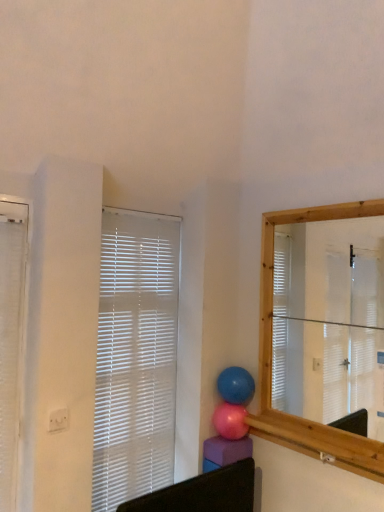
Question: Should I look upward or downward to see white textured window blind at left, acting as the second window blind starting from the right?

Choices:
 (A) down
 (B) up

Answer: (A)

Question: Can you confirm if white textured window blind at left, which ranks as the second window blind in back-to-front order, is positioned to the right of glossy blue balloon at center, the first balloon positioned from the top?

Choices:
 (A) no
 (B) yes

Answer: (A)

Question: Is white textured window blind at left, which ranks as the second window blind in back-to-front order, shorter than glossy blue balloon at center, the first balloon positioned from the top?

Choices:
 (A) yes
 (B) no

Answer: (B)

Question: From the image's perspective, is white textured window blind at left, acting as the second window blind starting from the right, on glossy blue balloon at center, the first balloon positioned from the top?

Choices:
 (A) no
 (B) yes

Answer: (B)

Question: Is glossy blue balloon at center, which ranks as the 2th balloon in bottom-to-top order, completely or partially inside white textured window blind at left, positioned as the first window blind in left-to-right order?

Choices:
 (A) no
 (B) yes

Answer: (A)

Question: Is the position of white textured window blind at left, positioned as the first window blind in left-to-right order, less distant than that of glossy blue balloon at center, the first balloon positioned from the top?

Choices:
 (A) yes
 (B) no

Answer: (A)

Question: Considering the relative sizes of white textured window blind at left, which ranks as the second window blind in back-to-front order, and glossy blue balloon at center, the first balloon positioned from the top, in the image provided, is white textured window blind at left, which ranks as the second window blind in back-to-front order, wider than glossy blue balloon at center, the first balloon positioned from the top,?

Choices:
 (A) yes
 (B) no

Answer: (B)

Question: Can you confirm if pink rubber balloon at center, the 1th balloon from the bottom, is bigger than white textured window blind at left, acting as the second window blind starting from the right?

Choices:
 (A) no
 (B) yes

Answer: (A)

Question: Is pink rubber balloon at center, the 1th balloon from the bottom, thinner than white textured window blind at left, positioned as the first window blind in left-to-right order?

Choices:
 (A) no
 (B) yes

Answer: (A)

Question: Is pink rubber balloon at center, the 1th balloon from the bottom, positioned with its back to white textured window blind at left, which ranks as the second window blind in back-to-front order?

Choices:
 (A) yes
 (B) no

Answer: (B)

Question: From a real-world perspective, is pink rubber balloon at center, the second balloon positioned from the top, below white textured window blind at left, which ranks as the second window blind in back-to-front order?

Choices:
 (A) no
 (B) yes

Answer: (B)

Question: Is pink rubber balloon at center, the 1th balloon from the bottom, at the right side of white textured window blind at left, arranged as the 1th window blind when viewed from the front?

Choices:
 (A) no
 (B) yes

Answer: (B)

Question: Is the depth of pink rubber balloon at center, the 1th balloon from the bottom, greater than that of white textured window blind at left, positioned as the first window blind in left-to-right order?

Choices:
 (A) no
 (B) yes

Answer: (B)

Question: Can you confirm if glossy blue balloon at center, which ranks as the 2th balloon in bottom-to-top order, is taller than white textured window blind at left, arranged as the 1th window blind when viewed from the front?

Choices:
 (A) yes
 (B) no

Answer: (B)